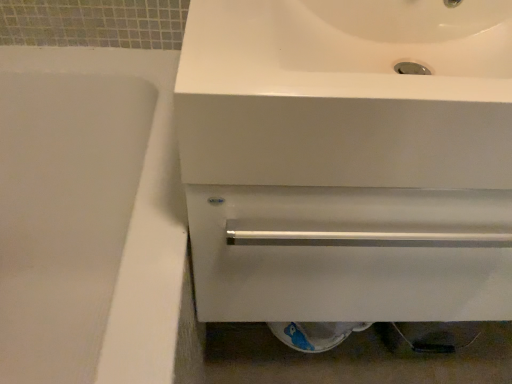
Question: Is white glossy bathtub at left directly adjacent to white glossy sink at upper center?

Choices:
 (A) no
 (B) yes

Answer: (A)

Question: Is white glossy bathtub at left to the right of white glossy sink at upper center from the viewer's perspective?

Choices:
 (A) no
 (B) yes

Answer: (A)

Question: Considering the relative positions of white glossy bathtub at left and white glossy sink at upper center in the image provided, is white glossy bathtub at left to the left of white glossy sink at upper center from the viewer's perspective?

Choices:
 (A) yes
 (B) no

Answer: (A)

Question: From a real-world perspective, is white glossy bathtub at left located higher than white glossy sink at upper center?

Choices:
 (A) no
 (B) yes

Answer: (A)

Question: Is the depth of white glossy bathtub at left less than that of white glossy sink at upper center?

Choices:
 (A) no
 (B) yes

Answer: (B)

Question: Is white glossy sink at upper center completely or partially inside white glossy bathtub at left?

Choices:
 (A) no
 (B) yes

Answer: (A)

Question: Does white glossy sink at upper center have a larger size compared to white glossy bathtub at left?

Choices:
 (A) yes
 (B) no

Answer: (B)

Question: Is white glossy sink at upper center turned away from white glossy bathtub at left?

Choices:
 (A) yes
 (B) no

Answer: (B)

Question: Is white glossy sink at upper center facing towards white glossy bathtub at left?

Choices:
 (A) no
 (B) yes

Answer: (A)

Question: Does white glossy sink at upper center appear on the right side of white glossy bathtub at left?

Choices:
 (A) yes
 (B) no

Answer: (A)

Question: From the image's perspective, is white glossy sink at upper center over white glossy bathtub at left?

Choices:
 (A) yes
 (B) no

Answer: (A)

Question: From a real-world perspective, is white glossy sink at upper center under white glossy bathtub at left?

Choices:
 (A) yes
 (B) no

Answer: (B)

Question: In the image, is white glossy bathtub at left positioned in front of or behind white glossy sink at upper center?

Choices:
 (A) behind
 (B) front

Answer: (B)